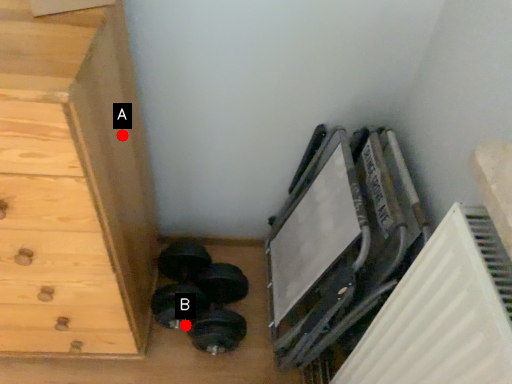
Question: Two points are circled on the image, labeled by A and B beside each circle. Which point is farther from the camera taking this photo?

Choices:
 (A) A is further
 (B) B is further

Answer: (B)